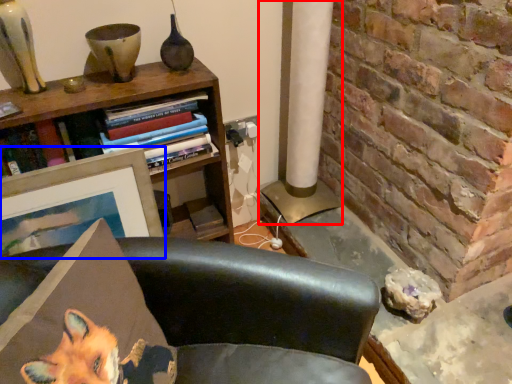
Question: Which object appears closest to the camera in this image, pillar (highlighted by a red box) or picture frame (highlighted by a blue box)?

Choices:
 (A) pillar
 (B) picture frame

Answer: (B)